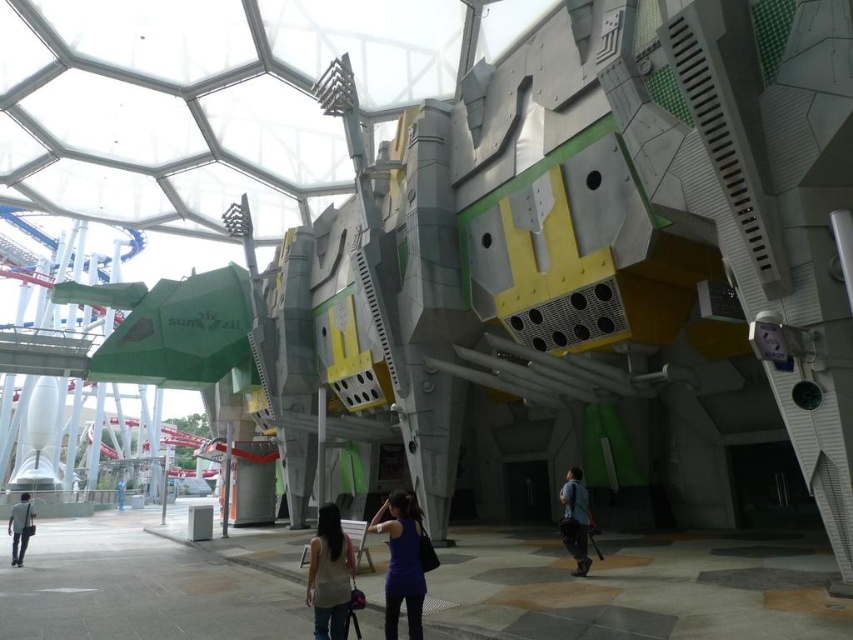
You are standing in front of the futuristic structure and notice two people wearing shirts of different colors. The person in the dark blue fabric shirt at lower right and the person in the light blue shirt at lower left. Which of the two shirts is smaller in size?

The dark blue fabric shirt at lower right occupies less space than the light blue shirt at lower left, so the dark blue fabric shirt at lower right is smaller in size.

You are standing in front of the futuristic structure and notice two people wearing the matte blue tank top at center and the dark blue fabric shirt at lower right. Which person is closer to you?

The matte blue tank top at center is closer to you because it is in front of the dark blue fabric shirt at lower right.

You are standing at the entrance of the industrial structure and see the light beige fabric shirt at lower center and the light blue shirt at lower left. Which person is closer to you?

The light beige fabric shirt at lower center is closer to the viewer than the light blue shirt at lower left, so the person wearing the light beige fabric shirt at lower center is closer to you.